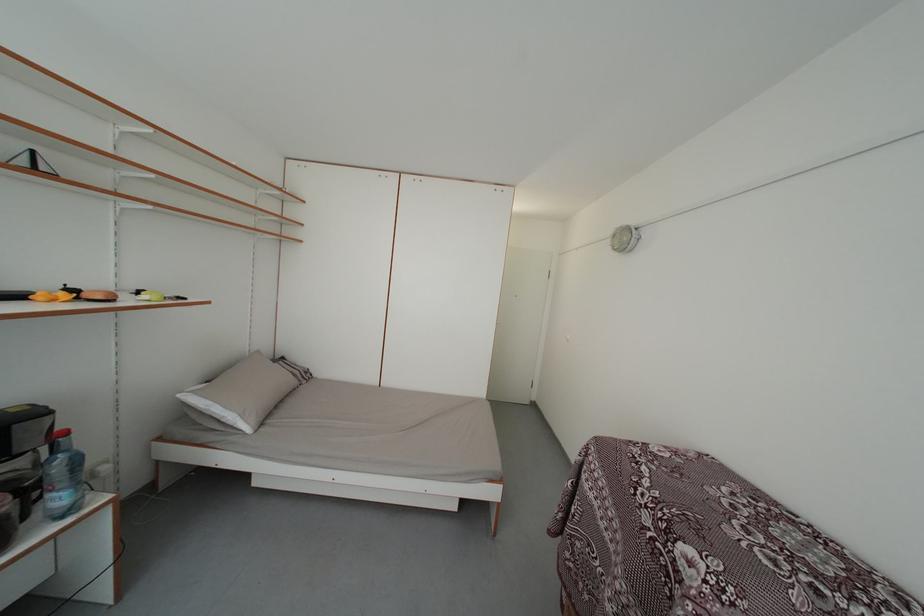
The location [63,477] corresponds to which object?

It corresponds to the large water bottle in the image.